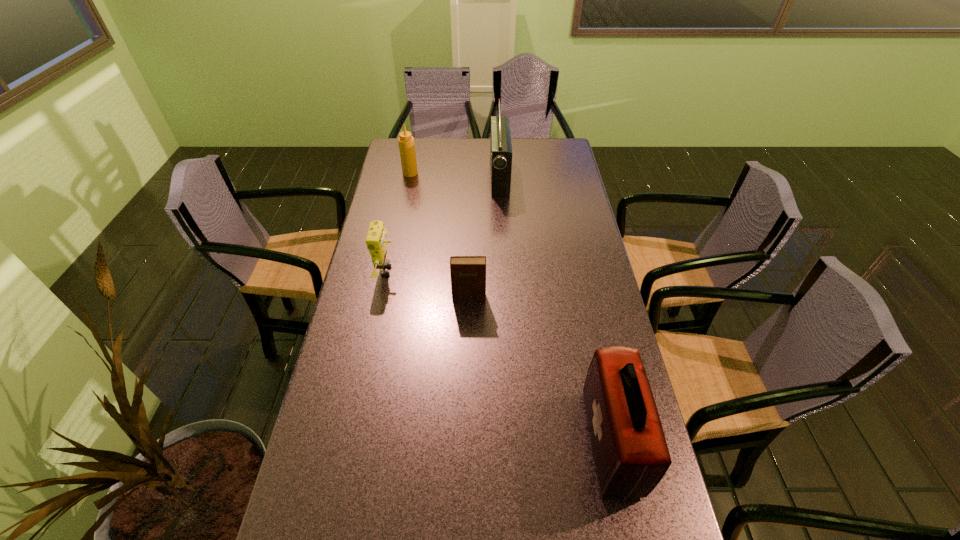
Locate an element on the screen. This screenshot has height=540, width=960. empty space between the third shortest object and the sponge is located at coordinates (398, 222).

In order to click on vacant area that lies between the third object from left to right and the radio receiver in this screenshot , I will do `click(484, 237)`.

Where is `the fourth closest object to the condiment`? the fourth closest object to the condiment is located at coordinates (631, 455).

You are a GUI agent. You are given a task and a screenshot of the screen. Output one action in this format:
    pyautogui.click(x=<x>, y=<y>)
    Task: Click on the object that stands as the fourth closest to the rightmost object
    
    Given the screenshot: What is the action you would take?
    pyautogui.click(x=406, y=141)

Identify the location of free space that satisfies the following two spatial constraints: 1. on the front side of the condiment; 2. on the face of the sponge. The height and width of the screenshot is (540, 960). (391, 271).

The height and width of the screenshot is (540, 960). Find the location of `free space that satisfies the following two spatial constraints: 1. on the front-facing side of the radio receiver; 2. on the front cover of the third object from right to left`. free space that satisfies the following two spatial constraints: 1. on the front-facing side of the radio receiver; 2. on the front cover of the third object from right to left is located at coordinates (506, 298).